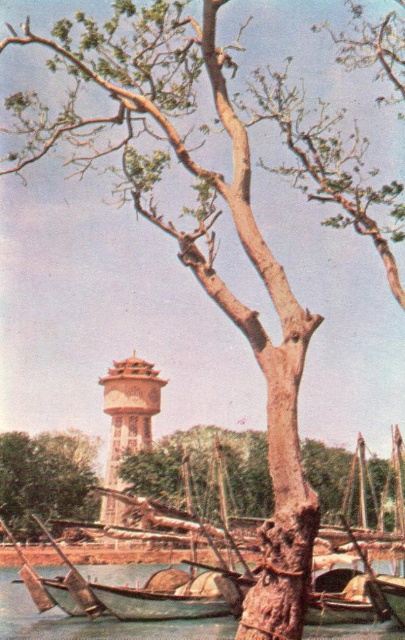
You are an artist planning to sketch this riverside scene. You want to ensure the proportions are accurate. Which object should you draw larger in your sketch, the brown rough tree trunk at center or the wooden boat at lower center?

The brown rough tree trunk at center should be drawn larger than the wooden boat at lower center because it is bigger in the scene.